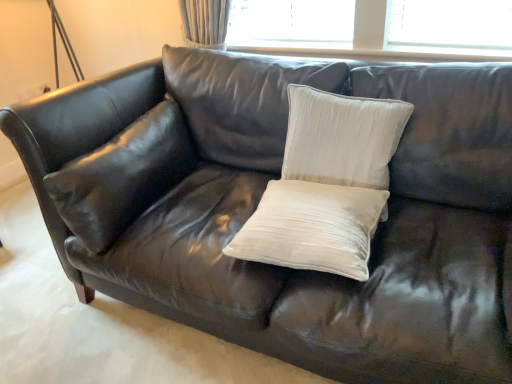
Question: From a real-world perspective, is satin white pillow at center, which is the 1th pillow from left to right, positioned above or below satin white pillow at center, acting as the 2th pillow starting from the left?

Choices:
 (A) below
 (B) above

Answer: (B)

Question: In the image, is satin white pillow at center, which is the 1th pillow from left to right, on the left side or the right side of satin white pillow at center, which ranks as the second pillow in right-to-left order?

Choices:
 (A) right
 (B) left

Answer: (B)

Question: Which object is positioned closest to the satin white pillow at center, which is counted as the third pillow, starting from the right?

Choices:
 (A) satin white pillow at center, which ranks as the second pillow in right-to-left order
 (B) white velvet pillow at center, arranged as the 1th pillow when viewed from the right

Answer: (A)

Question: Based on their relative distances, which object is farther from the white velvet pillow at center, which is counted as the third pillow, starting from the left?

Choices:
 (A) satin white pillow at center, which ranks as the second pillow in right-to-left order
 (B) satin white pillow at center, which is the 1th pillow from left to right

Answer: (B)